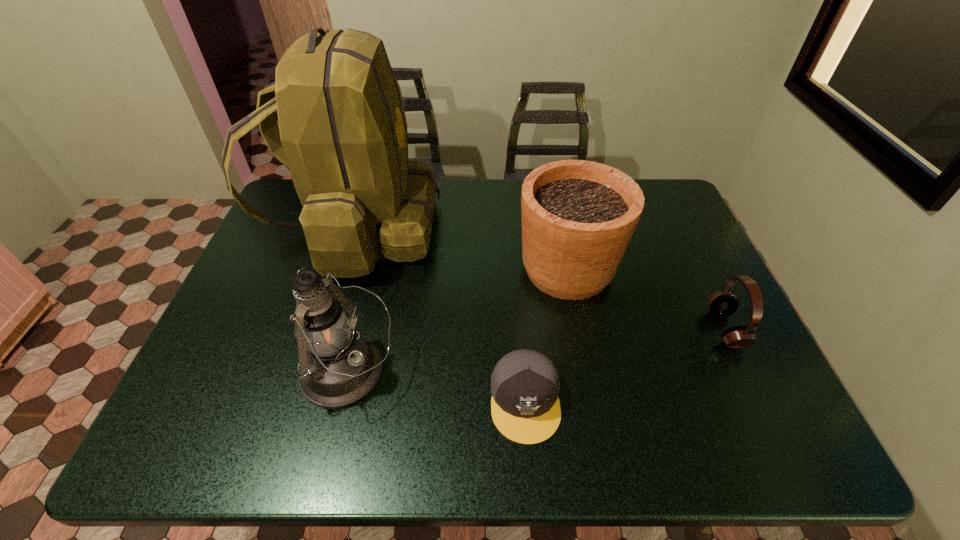
Find the location of a particular element. The height and width of the screenshot is (540, 960). object that ranks as the closest to the tallest object is located at coordinates (338, 367).

Find the location of `object that ranks as the third closest to the cap`. object that ranks as the third closest to the cap is located at coordinates (342, 134).

Locate an element on the screen. vacant space that satisfies the following two spatial constraints: 1. on the front-facing side of the tallest object; 2. on the back side of the oil lamp is located at coordinates (313, 372).

Where is `free space that satisfies the following two spatial constraints: 1. on the front-facing side of the third tallest object; 2. on the right side of the backpack`? The width and height of the screenshot is (960, 540). free space that satisfies the following two spatial constraints: 1. on the front-facing side of the third tallest object; 2. on the right side of the backpack is located at coordinates (345, 269).

Locate an element on the screen. The height and width of the screenshot is (540, 960). free space that satisfies the following two spatial constraints: 1. on the ear pads of the rightmost object; 2. on the front-facing side of the cap is located at coordinates (759, 401).

Locate an element on the screen. Image resolution: width=960 pixels, height=540 pixels. free space that satisfies the following two spatial constraints: 1. on the ear pads of the rightmost object; 2. on the front-facing side of the cap is located at coordinates (759, 401).

Locate an element on the screen. Image resolution: width=960 pixels, height=540 pixels. free space that satisfies the following two spatial constraints: 1. on the ear pads of the second shortest object; 2. on the front-facing side of the shortest object is located at coordinates (759, 401).